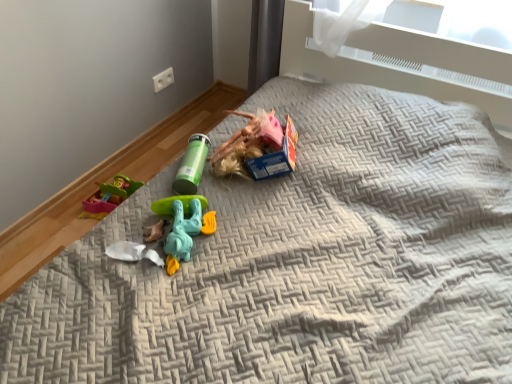
Question: From the image's perspective, is white plastic toy at center, the second toy in the back-to-front sequence, above or below green plastic tube at center, which is counted as the third toy, starting from the front?

Choices:
 (A) below
 (B) above

Answer: (A)

Question: In terms of size, does white plastic toy at center, the second toy in the back-to-front sequence, appear bigger or smaller than green plastic tube at center, which is the third toy in bottom-to-top order?

Choices:
 (A) big
 (B) small

Answer: (B)

Question: Based on their relative distances, which object is farther from the white plastic toy at center, the second toy in the back-to-front sequence?

Choices:
 (A) green plastic tube at center, which is counted as the third toy, starting from the front
 (B) teal plastic toy at center, positioned as the 2th toy in top-to-bottom order

Answer: (A)

Question: Which object is the closest to the green plastic tube at center, which is the third toy in bottom-to-top order?

Choices:
 (A) white plastic toy at center, acting as the second toy starting from the front
 (B) teal plastic toy at center, which ranks as the third toy in back-to-front order

Answer: (B)